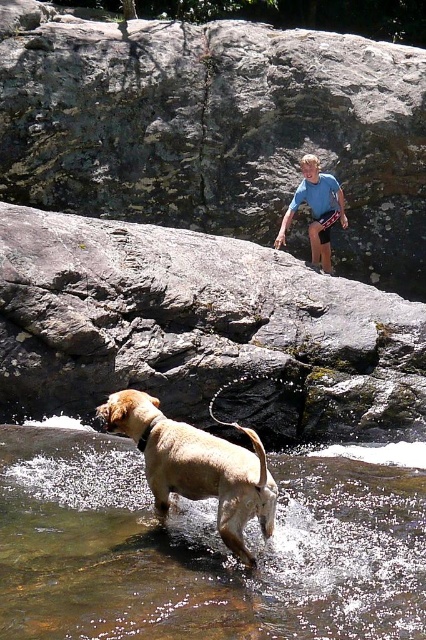
You are a photographer trying to capture a photo of the golden fur dog at lower center and the blue cotton shirt at upper center. Which object should you zoom in on to make them appear the same size in the photo?

Since the golden fur dog at lower center is smaller in size compared to the blue cotton shirt at upper center, you should zoom in on the golden fur dog at lower center to make them appear the same size in the photo.

You are standing on the gray rock at upper center and want to throw a stick to the golden fur dog at lower center. Which direction should you aim to ensure the stick reaches the dog?

The gray rock at upper center is above the golden fur dog at lower center, so you should aim downward to ensure the stick reaches the dog.